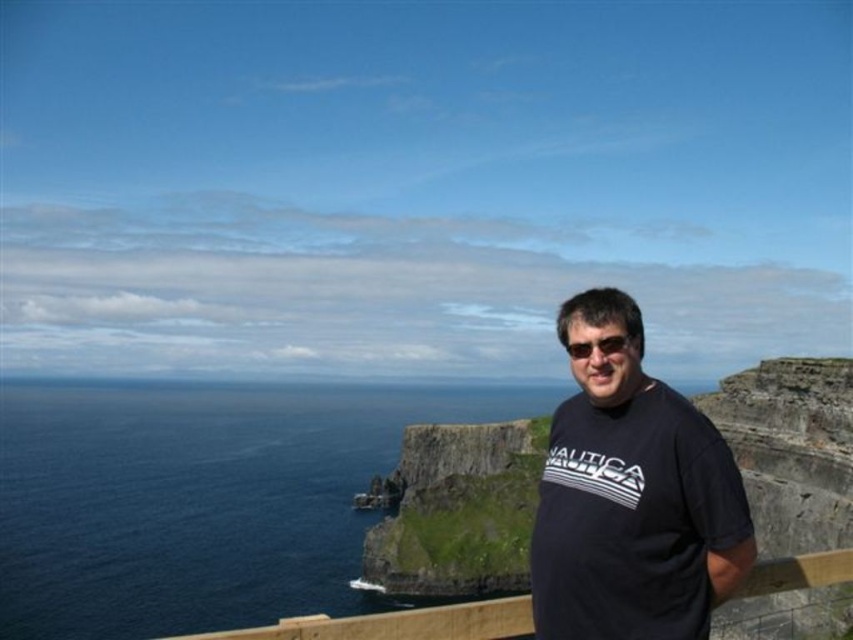
Is green mossy rock at center thinner than brown wooden rail at lower center?

Yes.

How much distance is there between green mossy rock at center and brown wooden rail at lower center?

A distance of 109.78 feet exists between green mossy rock at center and brown wooden rail at lower center.

Find the location of a particular element. green mossy rock at center is located at coordinates (459, 509).

At what (x,y) coordinates should I click in order to perform the action: click on green mossy rock at center. Please return your answer as a coordinate pair (x, y). Looking at the image, I should click on (459, 509).

Is point (732, 573) closer to viewer compared to point (744, 596)?

Yes, point (732, 573) is in front of point (744, 596).

Can you confirm if black cotton t-shirt at center is smaller than brown wooden rail at lower center?

Correct, black cotton t-shirt at center occupies less space than brown wooden rail at lower center.

Identify the location of black cotton t-shirt at center. Image resolution: width=853 pixels, height=640 pixels. (631, 497).

What do you see at coordinates (459, 509) in the screenshot?
I see `green mossy rock at center` at bounding box center [459, 509].

This screenshot has height=640, width=853. In order to click on green mossy rock at center in this screenshot , I will do [459, 509].